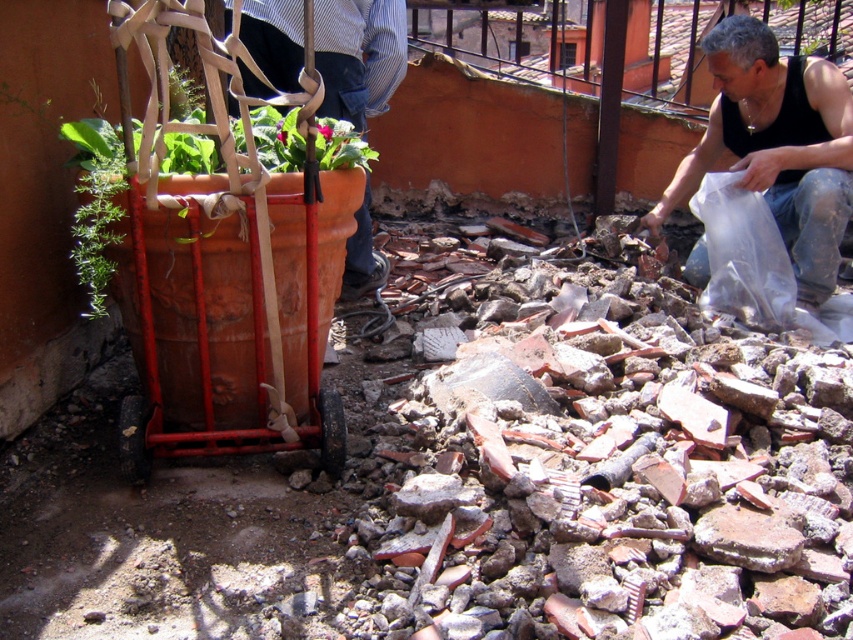
Between terracotta clay cart at left and black tank top at lower right, which one appears on the left side from the viewer's perspective?

terracotta clay cart at left

Between terracotta clay cart at left and black tank top at lower right, which one is positioned higher?

Positioned higher is black tank top at lower right.

Does point (283, 211) lie in front of point (708, 33)?

That is True.

Locate an element on the screen. The height and width of the screenshot is (640, 853). terracotta clay cart at left is located at coordinates (225, 259).

Who is taller, terracotta clay cart at left or striped shirt at upper center?

Standing taller between the two is terracotta clay cart at left.

Can you confirm if terracotta clay cart at left is taller than striped shirt at upper center?

Correct, terracotta clay cart at left is much taller as striped shirt at upper center.

You are a GUI agent. You are given a task and a screenshot of the screen. Output one action in this format:
    pyautogui.click(x=<x>, y=<y>)
    Task: Click on the terracotta clay cart at left
    This screenshot has height=640, width=853.
    Given the screenshot: What is the action you would take?
    pyautogui.click(x=225, y=259)

You are a GUI agent. You are given a task and a screenshot of the screen. Output one action in this format:
    pyautogui.click(x=<x>, y=<y>)
    Task: Click on the terracotta clay cart at left
    This screenshot has width=853, height=640.
    Given the screenshot: What is the action you would take?
    pyautogui.click(x=225, y=259)

Does black tank top at lower right appear on the right side of striped shirt at upper center?

Yes, black tank top at lower right is to the right of striped shirt at upper center.

Does black tank top at lower right appear over striped shirt at upper center?

No, black tank top at lower right is not above striped shirt at upper center.

Where is `black tank top at lower right`? The height and width of the screenshot is (640, 853). black tank top at lower right is located at coordinates (776, 145).

Locate an element on the screen. The image size is (853, 640). black tank top at lower right is located at coordinates (776, 145).